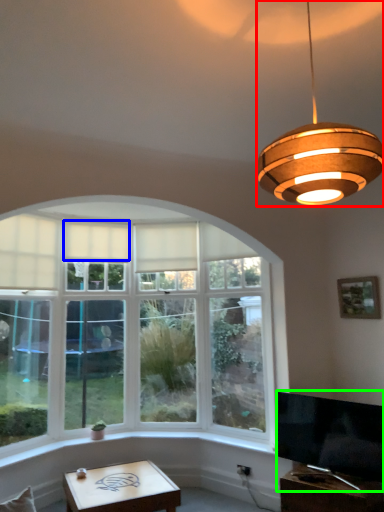
Question: Which object is the farthest from lamp (highlighted by a red box)? Choose among these: curtain (highlighted by a blue box) or television (highlighted by a green box).

Choices:
 (A) curtain
 (B) television

Answer: (A)